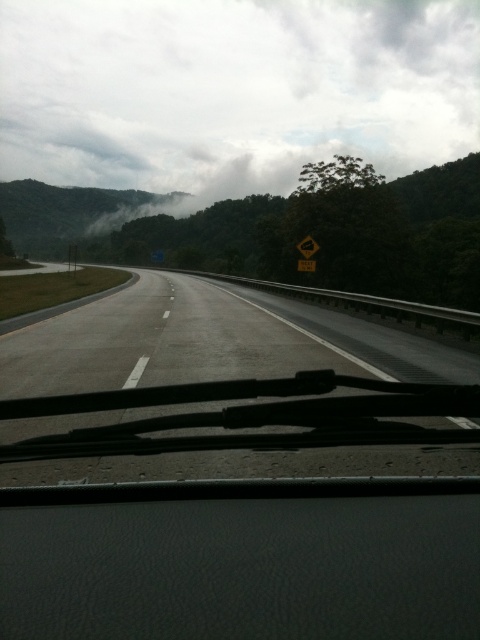
Question: Does white fluffy cloud at upper center have a larger size compared to yellow reflective road sign at center?

Choices:
 (A) yes
 (B) no

Answer: (A)

Question: Does gray asphalt highway at center have a larger size compared to yellow reflective road sign at center?

Choices:
 (A) yes
 (B) no

Answer: (A)

Question: Which of the following is the farthest from the observer?

Choices:
 (A) (308, 252)
 (B) (388, 125)

Answer: (B)

Question: Which object is closer to the camera taking this photo?

Choices:
 (A) yellow reflective road sign at center
 (B) gray asphalt highway at center

Answer: (B)

Question: Which of these objects is positioned closest to the gray asphalt highway at center?

Choices:
 (A) yellow reflective road sign at center
 (B) white fluffy cloud at upper center

Answer: (A)

Question: Is white fluffy cloud at upper center closer to camera compared to gray asphalt highway at center?

Choices:
 (A) yes
 (B) no

Answer: (B)